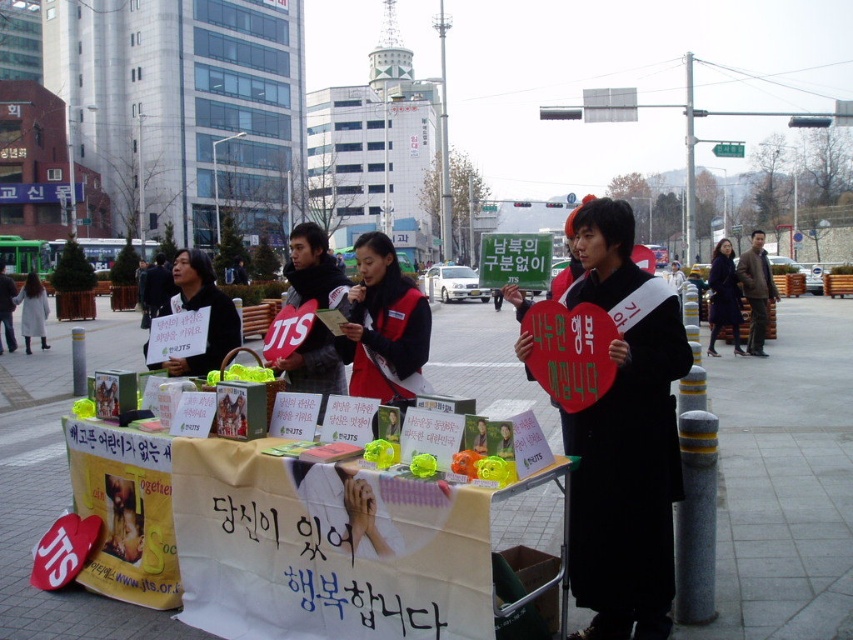
You are a pedestrian walking on the sidewalk and see the matte black sign at center and the dark blue wool coat at center. Which object is positioned to the left when facing the stall?

The matte black sign at center is to the left of the dark blue wool coat at center when facing the stall.

You are a pedestrian walking along the street and see two points marked on the ground. The first point is at coordinate point(213, 362) and the second is at point(722, 307). Which point is closer to you as you face the street?

Point(213, 362) is in front of point(722, 307), so it is closer to you as you face the street.

You are organizing a community event and need to decide whether to place a large banner on the matte black cart at center or on the black matte coat at center. Based on their sizes, which object would be more suitable for displaying the banner?

The matte black cart at center is bigger than the black matte coat at center, so the banner would be more suitable to display on the matte black cart at center.